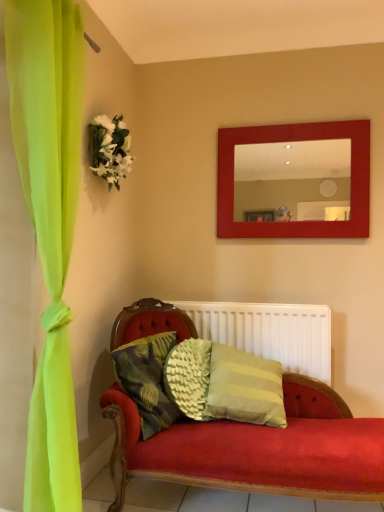
Question: Should I look upward or downward to see white silk flowers at upper left?

Choices:
 (A) up
 (B) down

Answer: (A)

Question: Is matte red mirror at upper center in contact with white matte radiator at center?

Choices:
 (A) no
 (B) yes

Answer: (A)

Question: Can you confirm if matte red mirror at upper center is wider than white matte radiator at center?

Choices:
 (A) no
 (B) yes

Answer: (A)

Question: From a real-world perspective, is matte red mirror at upper center positioned under white matte radiator at center based on gravity?

Choices:
 (A) no
 (B) yes

Answer: (A)

Question: Is matte red mirror at upper center located outside white matte radiator at center?

Choices:
 (A) no
 (B) yes

Answer: (B)

Question: From the image's perspective, is matte red mirror at upper center located above white matte radiator at center?

Choices:
 (A) yes
 (B) no

Answer: (A)

Question: Is matte red mirror at upper center not close to white matte radiator at center?

Choices:
 (A) no
 (B) yes

Answer: (A)

Question: Is white matte radiator at center wider than textured green pillow at center?

Choices:
 (A) no
 (B) yes

Answer: (A)

Question: From the image's perspective, does white matte radiator at center appear lower than textured green pillow at center?

Choices:
 (A) no
 (B) yes

Answer: (A)

Question: Is white matte radiator at center further to the viewer compared to textured green pillow at center?

Choices:
 (A) no
 (B) yes

Answer: (B)

Question: From a real-world perspective, is white matte radiator at center under textured green pillow at center?

Choices:
 (A) no
 (B) yes

Answer: (A)

Question: Can we say white matte radiator at center lies outside textured green pillow at center?

Choices:
 (A) yes
 (B) no

Answer: (A)

Question: Does white matte radiator at center have a lesser height compared to textured green pillow at center?

Choices:
 (A) yes
 (B) no

Answer: (B)

Question: Is textured green pillow at center wider than matte red mirror at upper center?

Choices:
 (A) yes
 (B) no

Answer: (A)